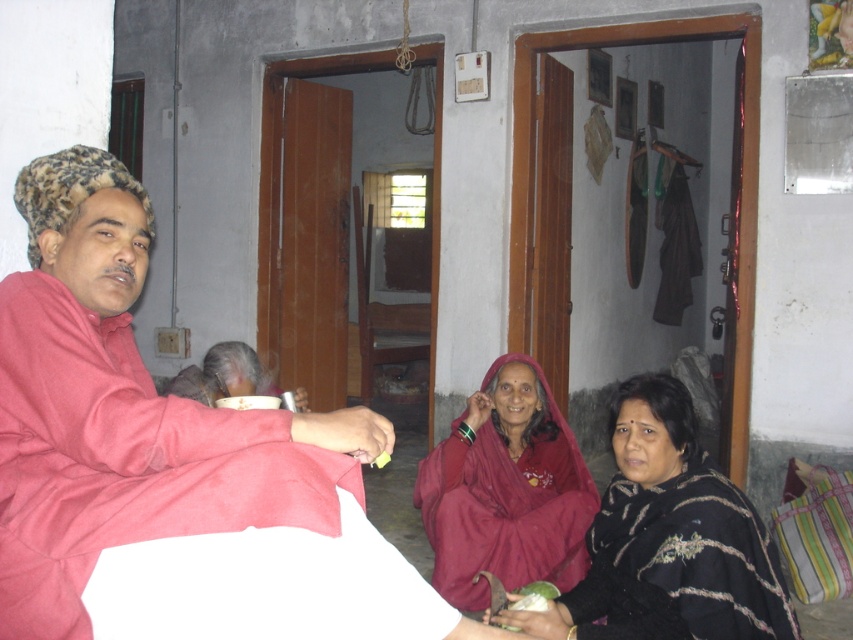
You are standing in the scene and want to place a small decorative item exactly at the position of the black textured shawl at lower right. What are the coordinates where you should place it?

The coordinates for placing the small decorative item should be at point (669,538), as that is the 2D location of the black textured shawl at lower right.

You are a delivery person trying to place a small package between the black textured shawl at lower right and the maroon fabric shawl at center. Can the package fit in the space between them?

The distance between the black textured shawl at lower right and the maroon fabric shawl at center is 33.29 inches, so the package can fit in the space between them since it is wider than the package.